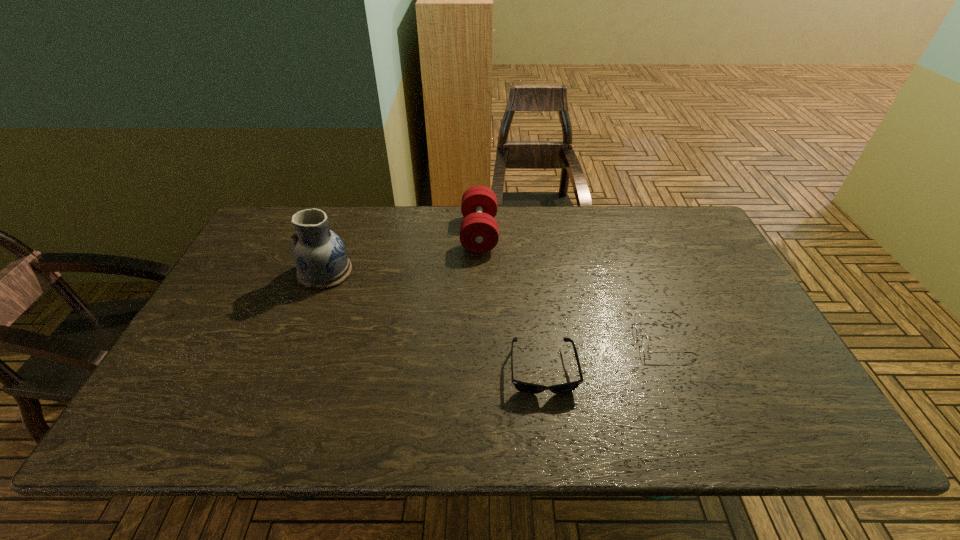
At what (x,y) coordinates should I click in order to perform the action: click on free spot between the rightmost object and the tallest object. Please return your answer as a coordinate pair (x, y). The width and height of the screenshot is (960, 540). Looking at the image, I should click on (494, 305).

I want to click on unoccupied position between the dumbbell and the second object from right to left, so click(x=511, y=302).

This screenshot has height=540, width=960. In order to click on free area in between the second object from right to left and the leftmost object in this screenshot , I will do `click(434, 321)`.

Identify the location of vacant area that lies between the pottery and the second object from left to right. The image size is (960, 540). (402, 253).

This screenshot has width=960, height=540. In order to click on free space between the spectacles and the dumbbell in this screenshot , I will do `click(571, 286)`.

In order to click on free point between the leftmost object and the third object from left to right in this screenshot , I will do `click(434, 321)`.

Locate an element on the screen. The width and height of the screenshot is (960, 540). vacant area that lies between the rightmost object and the second object from right to left is located at coordinates (603, 354).

Locate an element on the screen. The width and height of the screenshot is (960, 540). free space between the leftmost object and the spectacles is located at coordinates (494, 305).

At what (x,y) coordinates should I click in order to perform the action: click on unoccupied area between the spectacles and the second object from right to left. Please return your answer as a coordinate pair (x, y). Looking at the image, I should click on (603, 354).

Select which object is the closest to the rightmost object. Please provide its 2D coordinates. Your answer should be formatted as a tuple, i.e. [(x, y)], where the tuple contains the x and y coordinates of a point satisfying the conditions above.

[(525, 387)]